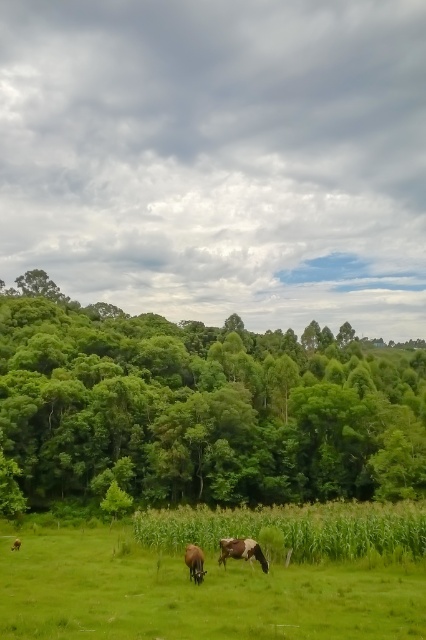
Question: Considering the relative positions of brown and white cow at center and brown glossy cow at center in the image provided, where is brown and white cow at center located with respect to brown glossy cow at center?

Choices:
 (A) below
 (B) above

Answer: (B)

Question: Is brown glossy horse at center wider than brown glossy cow at center?

Choices:
 (A) no
 (B) yes

Answer: (B)

Question: Estimate the real-world distances between objects in this image. Which object is farther from the green leafy trees at left?

Choices:
 (A) green grass pasture at lower center
 (B) brown and white cow at center
 (C) brown glossy horse at center

Answer: (C)

Question: Which object appears closest to the camera in this image?

Choices:
 (A) green leafy trees at left
 (B) brown glossy horse at center

Answer: (B)

Question: In this image, where is green leafy trees at left located relative to brown glossy horse at center?

Choices:
 (A) left
 (B) right

Answer: (B)

Question: Among these points, which one is farthest from the camera?

Choices:
 (A) (16, 548)
 (B) (189, 573)

Answer: (A)